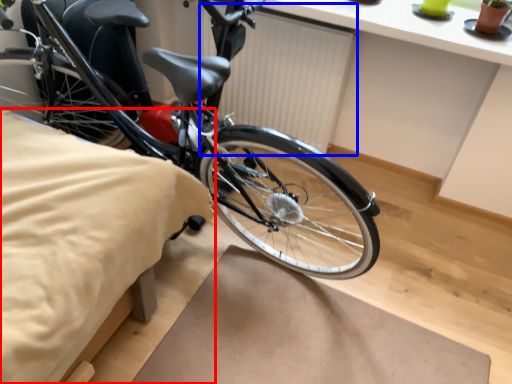
Question: Which of the following is the farthest to the observer, sheet (highlighted by a red box) or radiator (highlighted by a blue box)?

Choices:
 (A) sheet
 (B) radiator

Answer: (B)